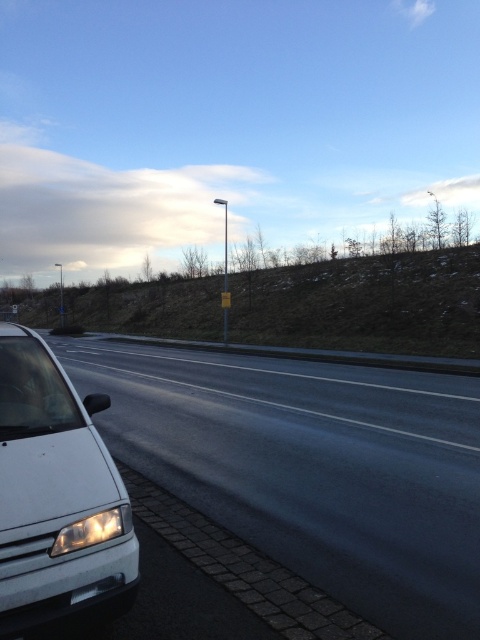
Question: Which object appears farthest from the camera in this image?

Choices:
 (A) black asphalt highway at left
 (B) white matte van at left

Answer: (B)

Question: Which point is farther from the camera taking this photo?

Choices:
 (A) (75, 540)
 (B) (443, 595)
 (C) (96, 609)

Answer: (B)

Question: Is black asphalt highway at left above matte white headlight at lower left?

Choices:
 (A) yes
 (B) no

Answer: (B)

Question: Which point appears closest to the camera in this image?

Choices:
 (A) (64, 529)
 (B) (101, 416)
 (C) (93, 483)

Answer: (A)

Question: Where is black asphalt highway at left located in relation to white matte van at left in the image?

Choices:
 (A) right
 (B) left

Answer: (A)

Question: Observing the image, what is the correct spatial positioning of white matte van at left in reference to matte white headlight at lower left?

Choices:
 (A) above
 (B) below

Answer: (A)